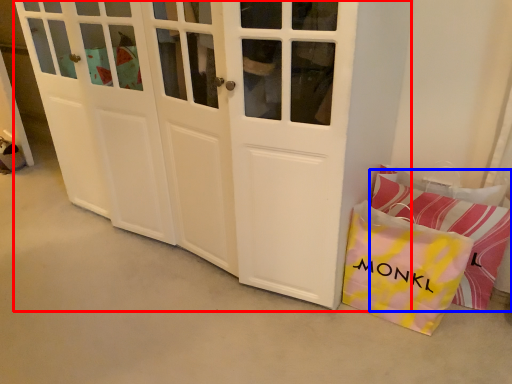
Question: Among these objects, which one is nearest to the camera, door (highlighted by a red box) or pillow (highlighted by a blue box)?

Choices:
 (A) door
 (B) pillow

Answer: (A)